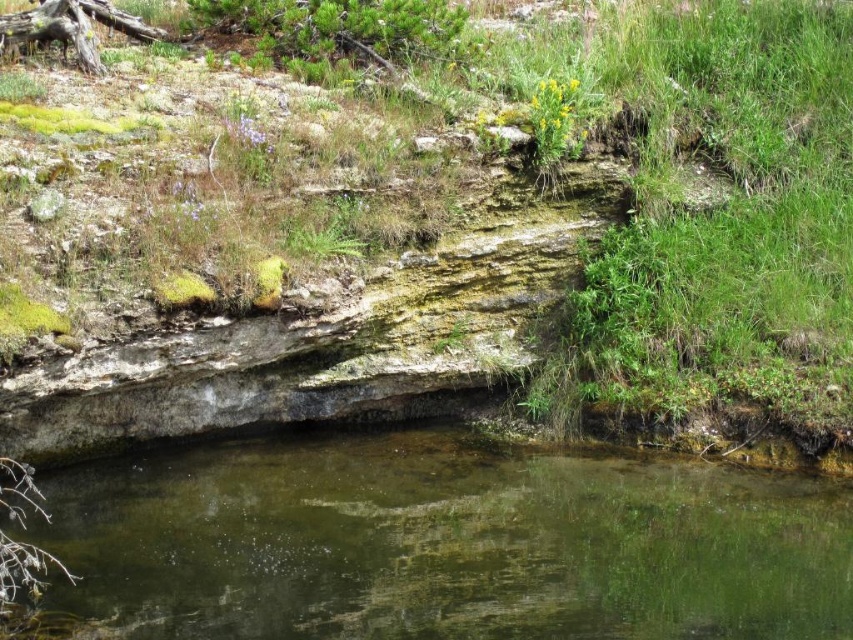
Is point (22, 308) behind point (674, 486)?

That is False.

Does green mossy rock at center have a lesser width compared to clear water at bottom?

Indeed, green mossy rock at center has a lesser width compared to clear water at bottom.

Which is in front, point (274, 348) or point (201, 496)?

Point (274, 348) is in front.

The width and height of the screenshot is (853, 640). I want to click on green mossy rock at center, so click(457, 244).